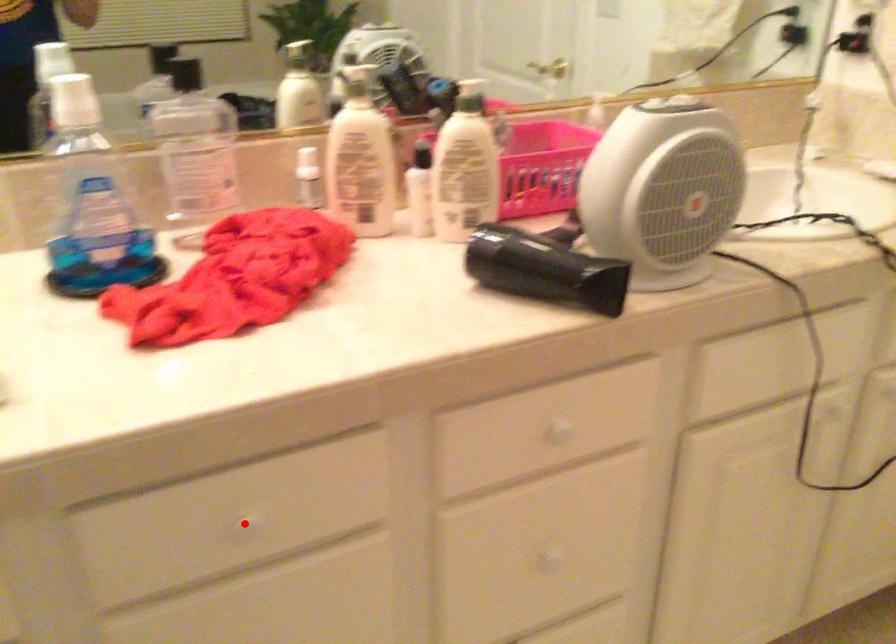
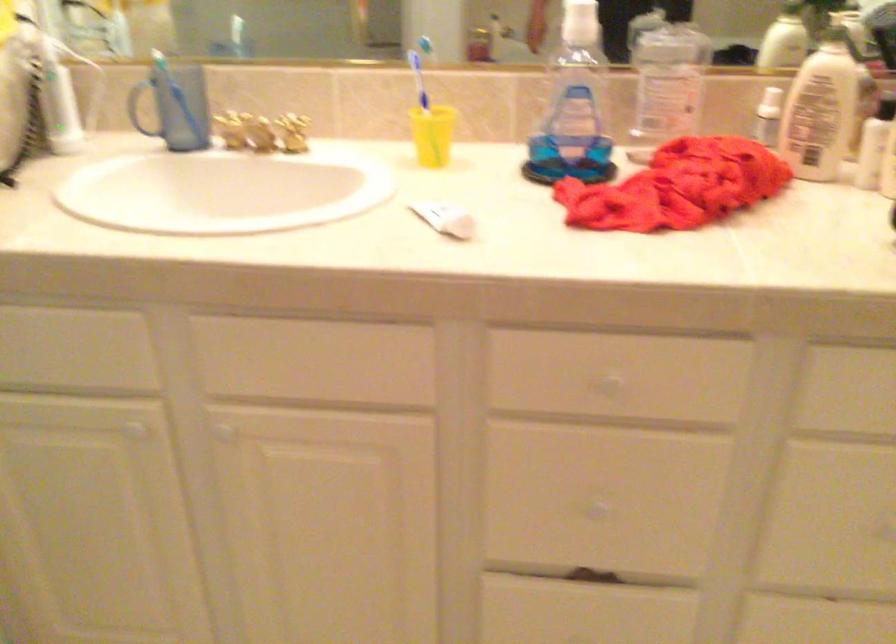
The point at the highlighted location is marked in the first image. Where is the corresponding point in the second image?

(609, 384)